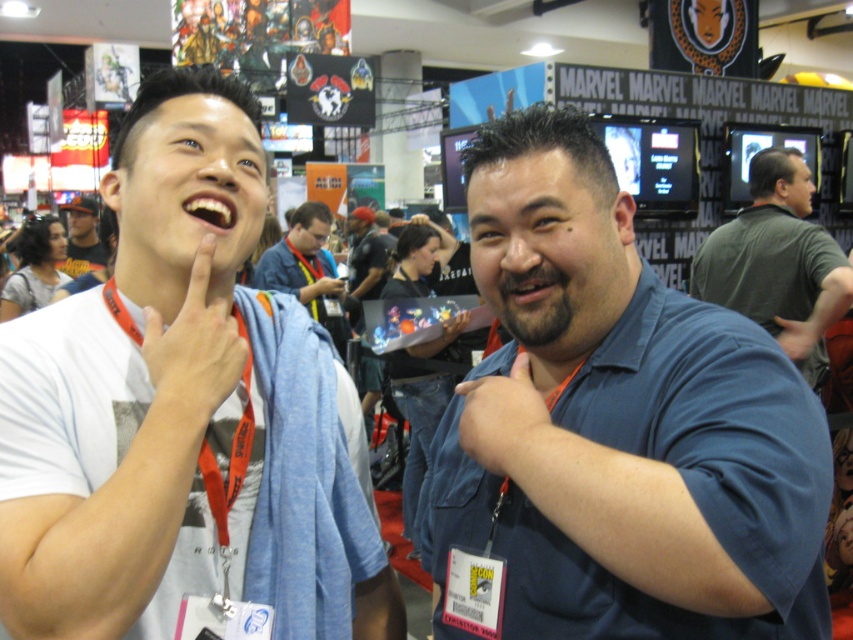
Question: Does dark gray t-shirt at upper right have a larger size compared to matte black hand at lower right?

Choices:
 (A) no
 (B) yes

Answer: (B)

Question: Based on their relative distances, which object is nearer to the dark blue shirt at center?

Choices:
 (A) matte black laptop at center
 (B) blue denim jacket at center

Answer: (B)

Question: Which point is farther to the camera?

Choices:
 (A) click(341, 292)
 (B) click(624, 282)
 (C) click(125, 253)

Answer: (A)

Question: Which of the following is the closest to the observer?

Choices:
 (A) (143, 356)
 (B) (379, 236)
 (C) (529, 296)
 (D) (781, 237)

Answer: (A)

Question: Can you confirm if blue fabric hand at center is wider than matte black cap at upper left?

Choices:
 (A) yes
 (B) no

Answer: (B)

Question: Does blue fabric hand at center appear on the left side of matte black cap at upper left?

Choices:
 (A) no
 (B) yes

Answer: (A)